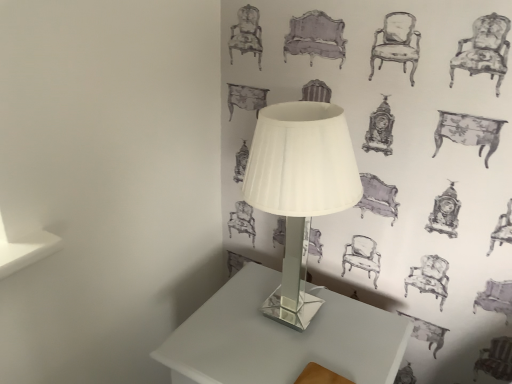
You are a GUI agent. You are given a task and a screenshot of the screen. Output one action in this format:
    pyautogui.click(x=<x>, y=<y>)
    Task: Click on the vacant space situated above white glossy table at center (from a real-world perspective)
    The height and width of the screenshot is (384, 512).
    Given the screenshot: What is the action you would take?
    pyautogui.click(x=287, y=332)